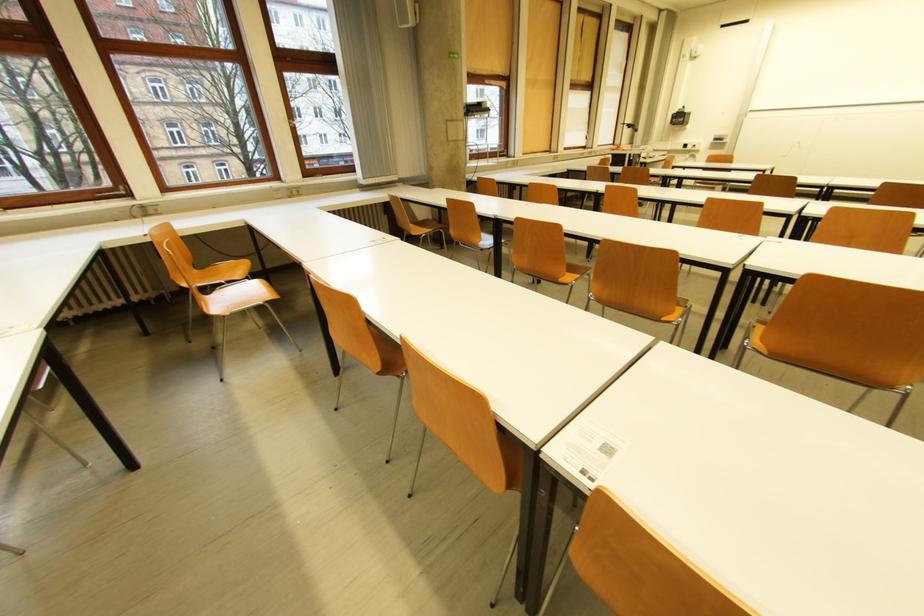
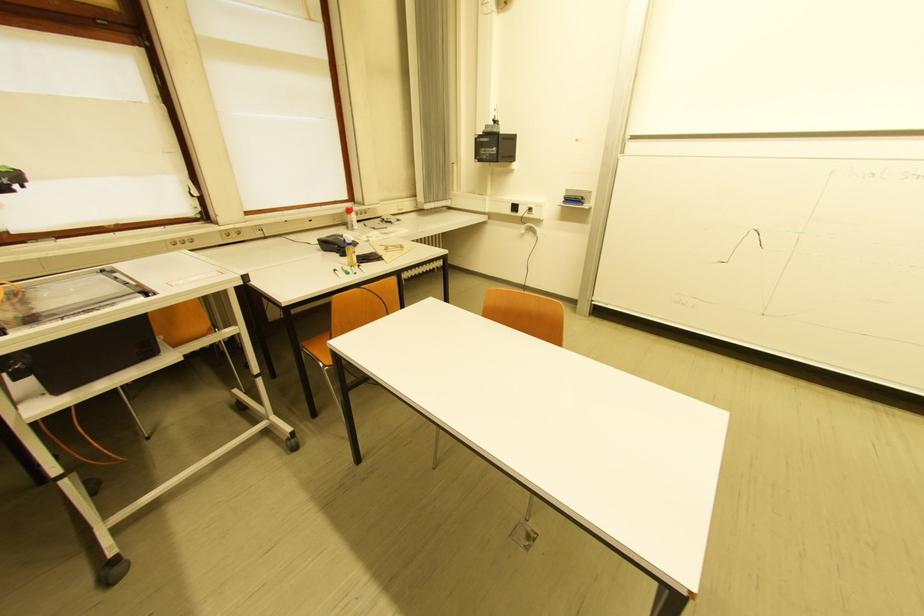
Find the pixel in the second image that matches [723,140] in the first image.

(575, 201)